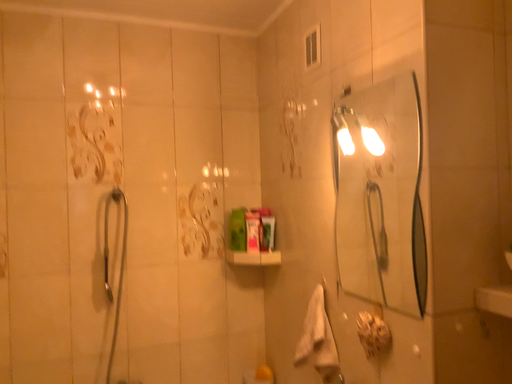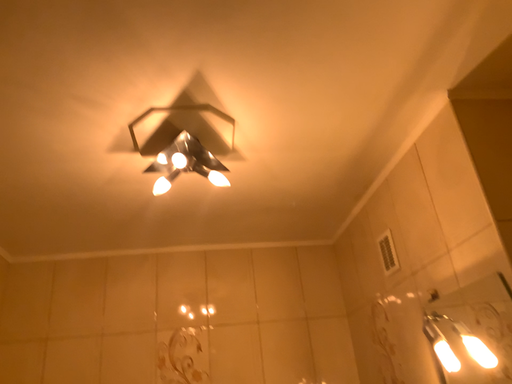
Question: How did the camera likely rotate when shooting the video?

Choices:
 (A) rotated right
 (B) rotated left

Answer: (B)